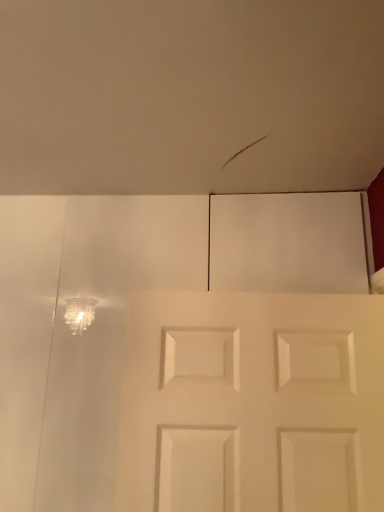
Question: Should I look upward or downward to see matte white ceiling at upper center?

Choices:
 (A) down
 (B) up

Answer: (B)